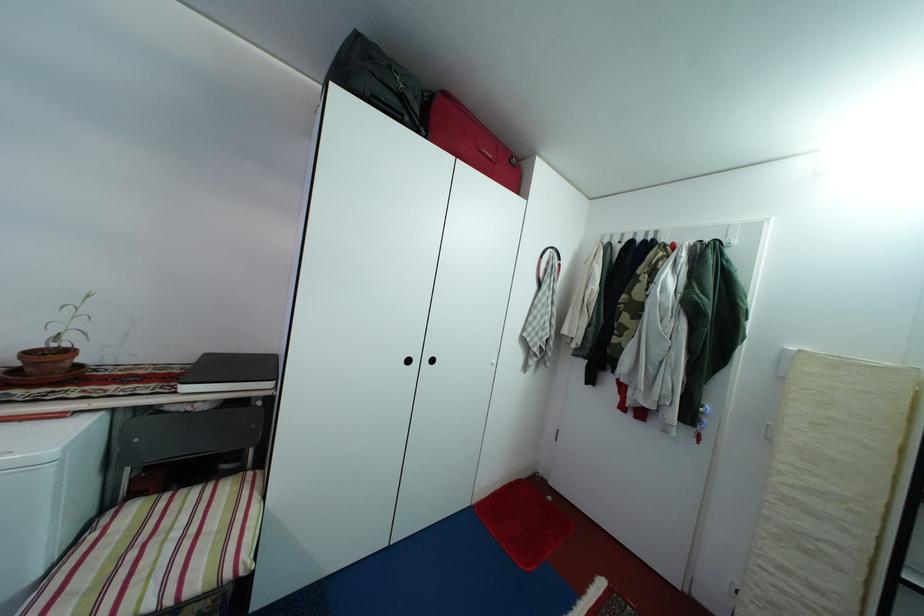
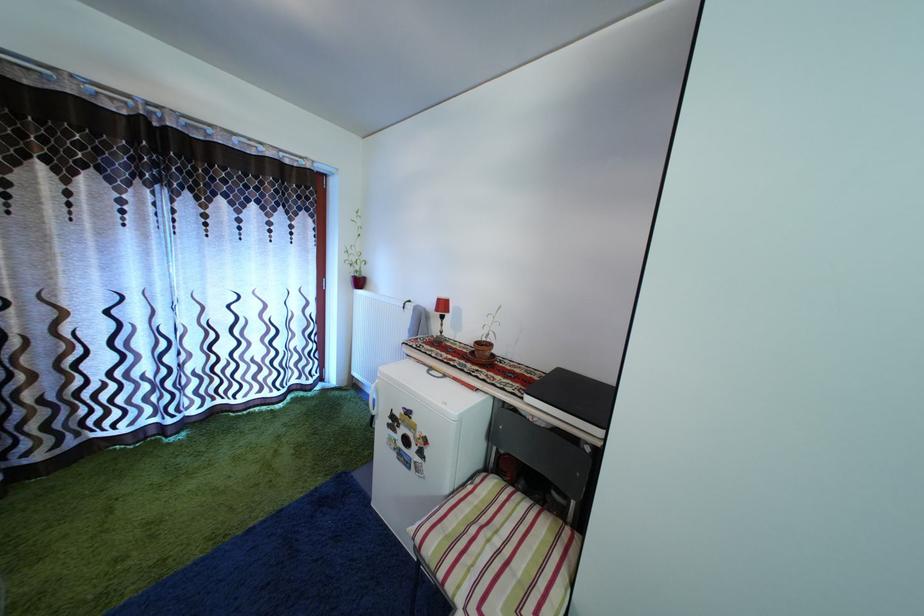
Find the pixel in the second image that matches point 185,541 in the first image.

(505, 549)